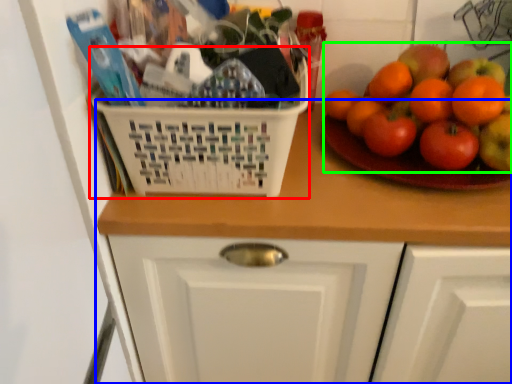
Question: Based on their relative distances, which object is farther from basket (highlighted by a red box)? Choose from counter (highlighted by a blue box) and fruit (highlighted by a green box).

Choices:
 (A) counter
 (B) fruit

Answer: (B)